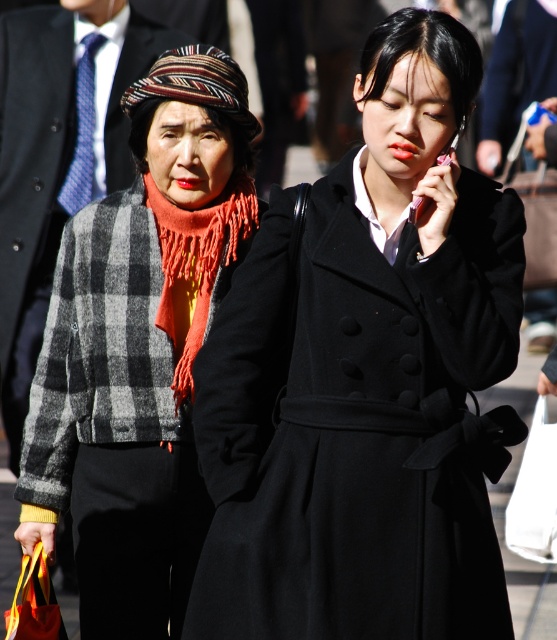
Question: Which of these objects is positioned closest to the white fabric bag at lower right?

Choices:
 (A) orange fringed scarf at center
 (B) matte black coat at center
 (C) plaid woolen jacket at left

Answer: (B)

Question: Among these objects, which one is farthest from the camera?

Choices:
 (A) orange fringed scarf at center
 (B) white fabric bag at lower right
 (C) matte black coat at center
 (D) plaid woolen jacket at left

Answer: (B)

Question: Which object is closer to the camera taking this photo?

Choices:
 (A) orange fringed scarf at center
 (B) matte black coat at center

Answer: (B)

Question: Is matte black coat at center below white fabric bag at lower right?

Choices:
 (A) no
 (B) yes

Answer: (A)

Question: Is plaid woolen jacket at left in front of white fabric bag at lower right?

Choices:
 (A) yes
 (B) no

Answer: (A)

Question: Is plaid woolen jacket at left positioned before orange fringed scarf at center?

Choices:
 (A) no
 (B) yes

Answer: (B)